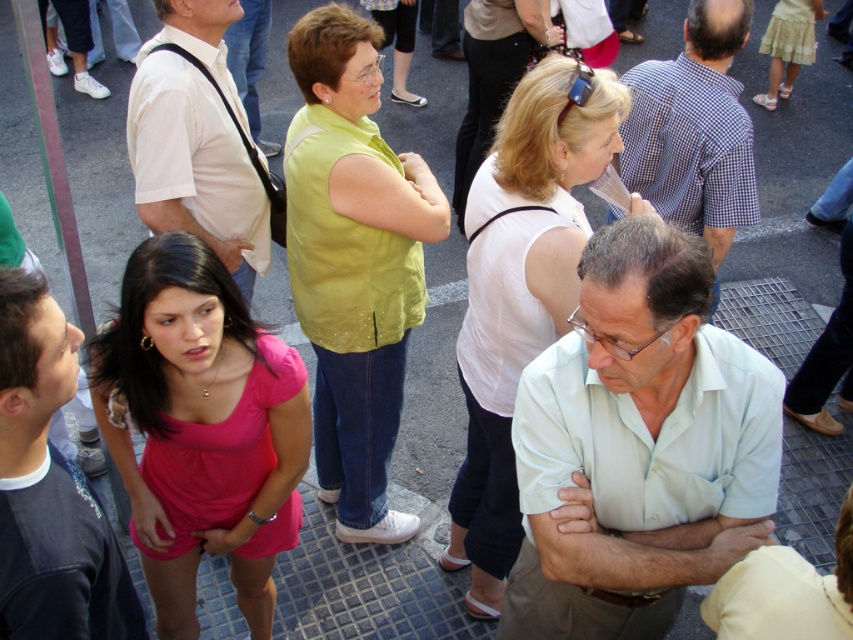
You are a photographer trying to capture a candid shot of the light blue shirt at center and the pink fabric dress at center. Which one will appear larger in your photo?

The light blue shirt at center will appear larger in the photo because it is closer to the viewer than the pink fabric dress at center.

You are standing at the point marked by the coordinates point (639, 444). Looking around, you see a light blue shirt at center. Which direction should you face to see the light blue shirt at center?

You are already facing the light blue shirt at center because the point (639, 444) marks its location.

You are standing at the origin point in the image. There are two points marked as point 1 at coordinates point (x=665, y=476) and point 2 at coordinates point (x=1, y=563). Which point is closer to you?

Point 2 at coordinates point (x=1, y=563) is closer to you because it has a smaller y coordinate value, indicating it is closer to the bottom of the image, which is typically where the viewer is positioned.